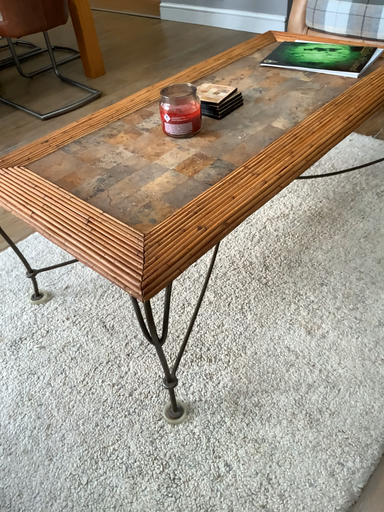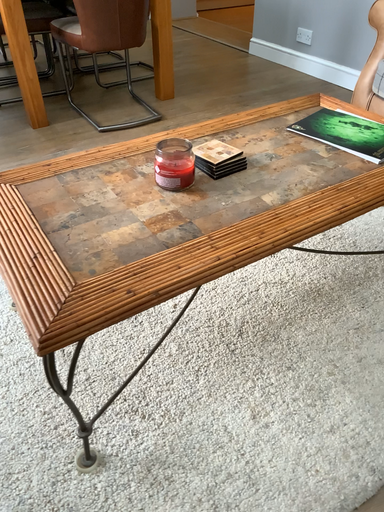
Question: Which way did the camera rotate in the video?

Choices:
 (A) rotated left
 (B) rotated right

Answer: (A)